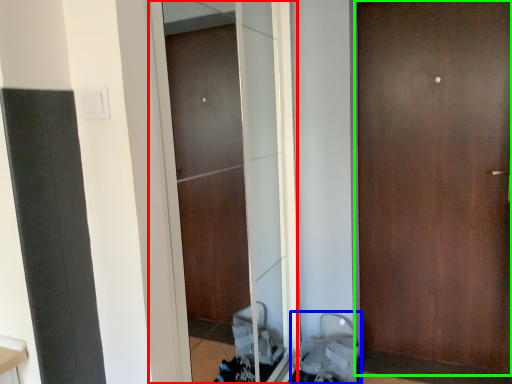
Question: Considering the real-world distances, which object is closest to screen door (highlighted by a red box)? baby carriage (highlighted by a blue box) or door (highlighted by a green box).

Choices:
 (A) baby carriage
 (B) door

Answer: (A)